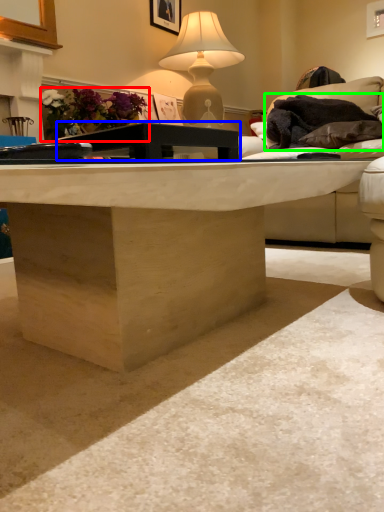
Question: Which is nearer to the flower (highlighted by a red box)? table (highlighted by a blue box) or material (highlighted by a green box).

Choices:
 (A) table
 (B) material

Answer: (B)